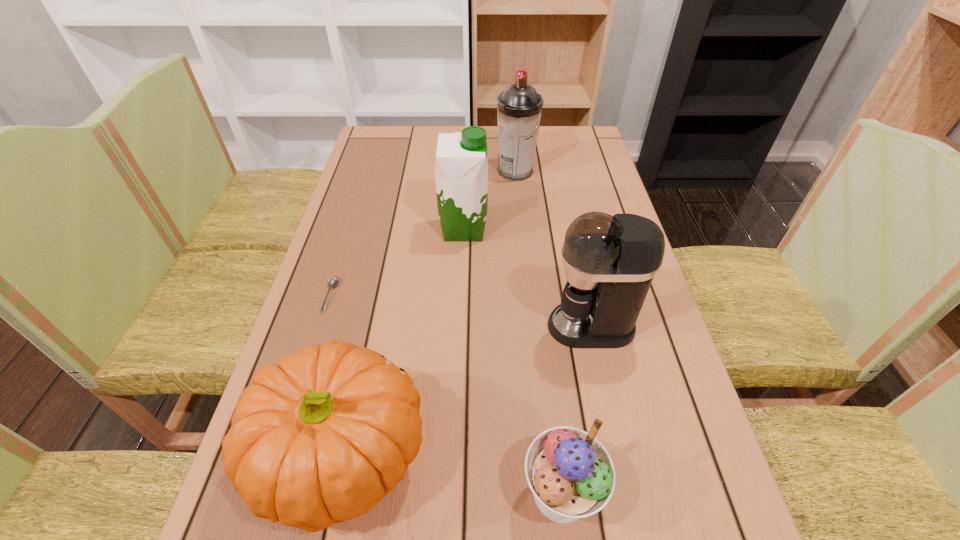
Where is `free spot located 0.150m on the left of the fifth tallest object`? free spot located 0.150m on the left of the fifth tallest object is located at coordinates (431, 493).

The height and width of the screenshot is (540, 960). In order to click on vacant space located on the back of the soupspoon in this screenshot , I will do `click(355, 217)`.

Locate an element on the screen. object that is at the far edge is located at coordinates (519, 107).

I want to click on object located at the left edge, so click(x=334, y=280).

This screenshot has width=960, height=540. Identify the location of object that is at the right edge. pyautogui.click(x=610, y=261).

In the image, there is a desktop. Identify the location of vacant space at the far edge. (451, 132).

In the image, there is a desktop. At what (x,y) coordinates should I click in order to perform the action: click on vacant space at the left edge. Please return your answer as a coordinate pair (x, y). This screenshot has height=540, width=960. Looking at the image, I should click on (322, 273).

You are a GUI agent. You are given a task and a screenshot of the screen. Output one action in this format:
    pyautogui.click(x=<x>, y=<y>)
    Task: Click on the vacant region at the right edge of the desktop
    Image resolution: width=960 pixels, height=540 pixels.
    Given the screenshot: What is the action you would take?
    pyautogui.click(x=600, y=174)

Identify the location of free space at the far left corner. The height and width of the screenshot is (540, 960). (395, 158).

Where is `vacant space that is in between the icecream and the fifth nearest object`? The image size is (960, 540). vacant space that is in between the icecream and the fifth nearest object is located at coordinates (513, 361).